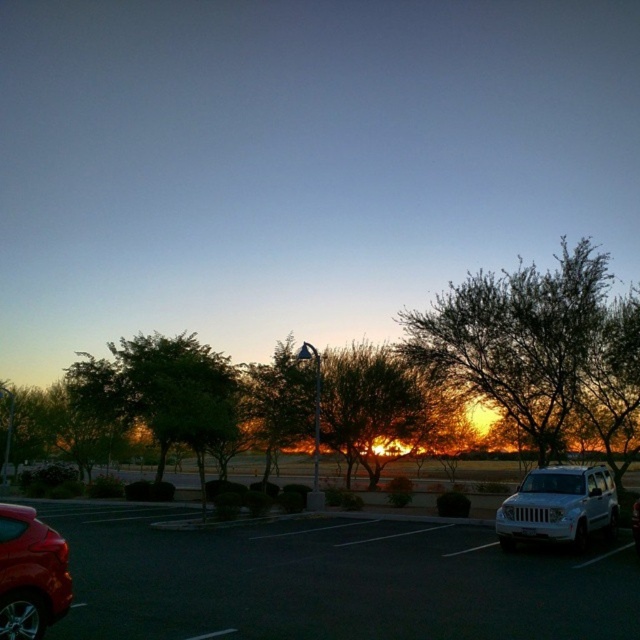
You are standing at the center of the parking lot and want to walk to the green leafy tree at upper right. There is a metallic silver car at lower right in your way. Can you walk around it without getting too close? The minimum safe distance to maintain is 2 meters.

The distance between the metallic silver car at lower right and green leafy tree at upper right is 9.60 meters. Since the minimum safe distance required is 2 meters, you can walk around the metallic silver car at lower right while maintaining the required distance.